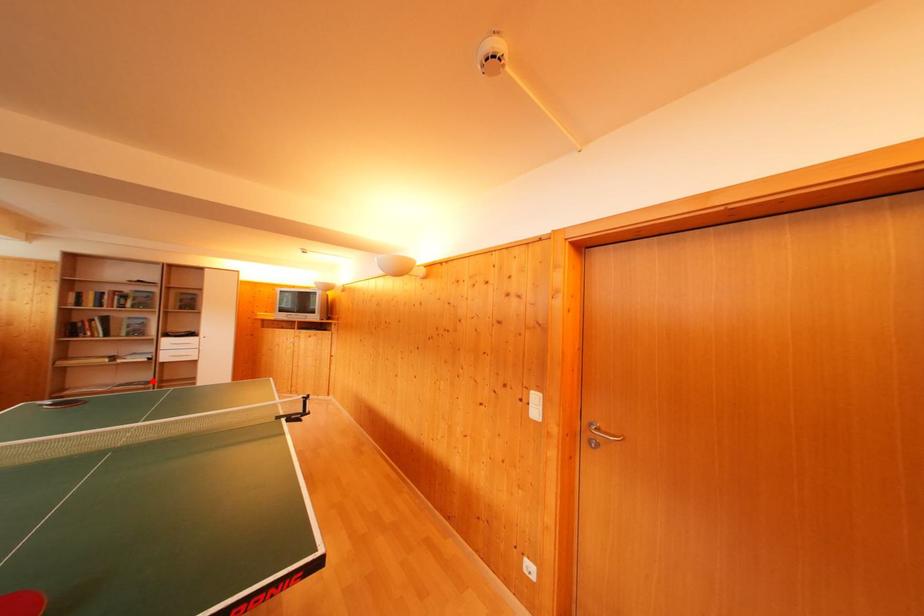
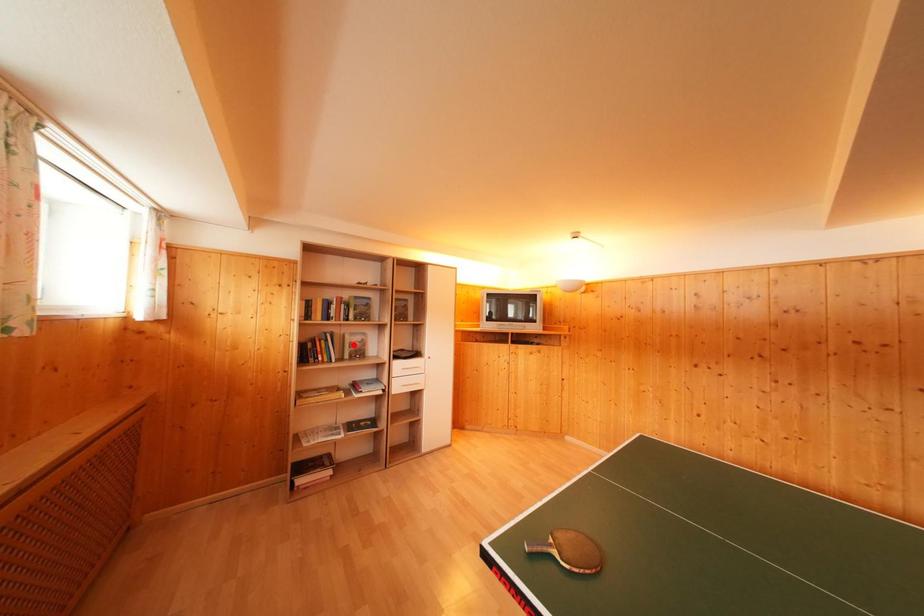
I am providing you with two images of the same scene from different viewpoints. A red point is marked on the first image and another point is marked on the second image. Are the points marked in image1 and image2 representing the same 3D position?

No